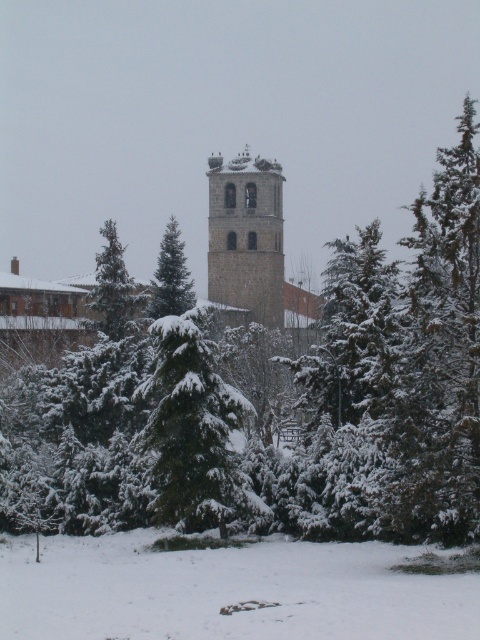
You are standing in the winter scene and want to walk from the point closer to you to the point farther away. Which path would you take between the two points, point (78, 547) or point (175, 269)?

You should take the path to point (175, 269) because it is farther away from you compared to point (78, 547) which is closer.